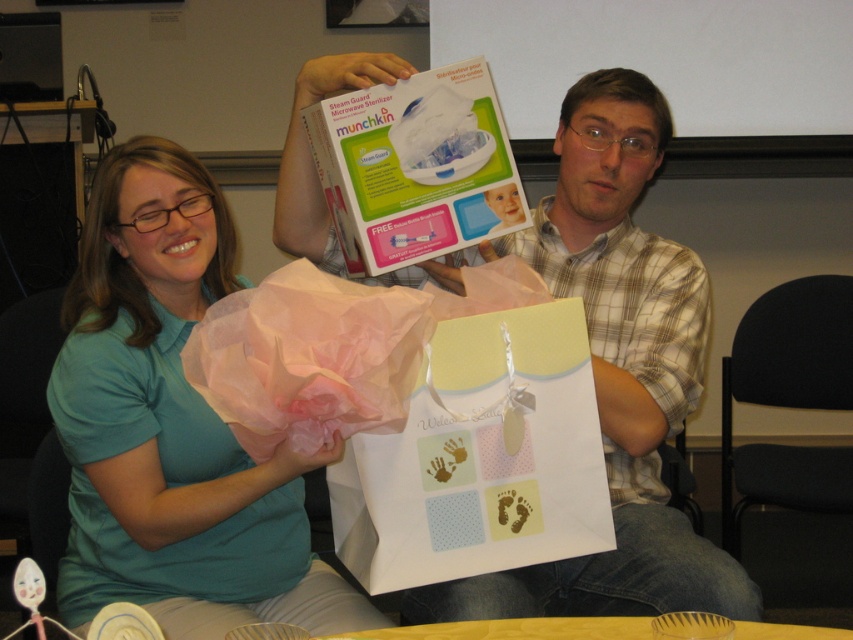
You are attending a baby shower and notice two guests wearing the teal fabric shirt at center and the plaid shirt at center. If you want to find the taller person between them, which shirt should you look for?

The plaid shirt at center is taller than the teal fabric shirt at center, so the person wearing the plaid shirt at center is taller.